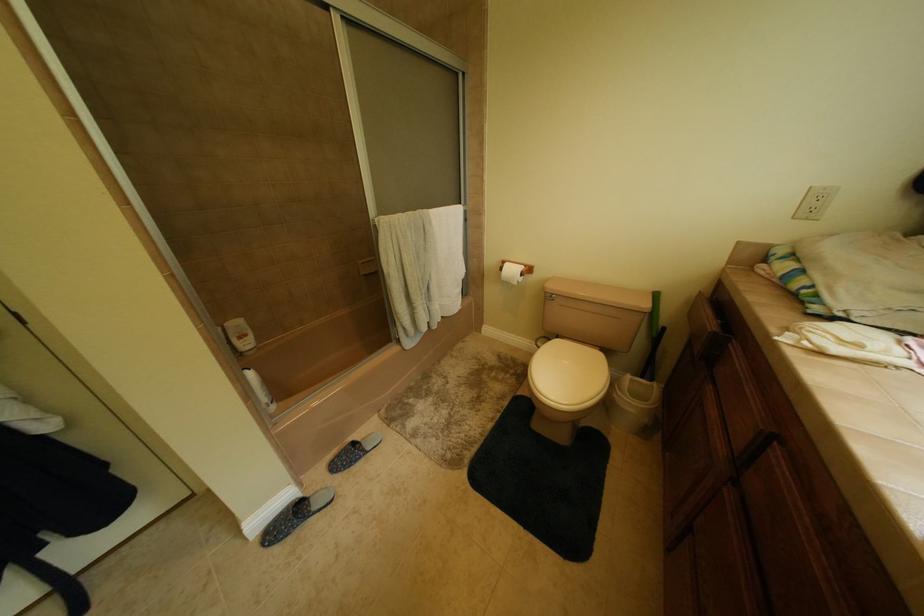
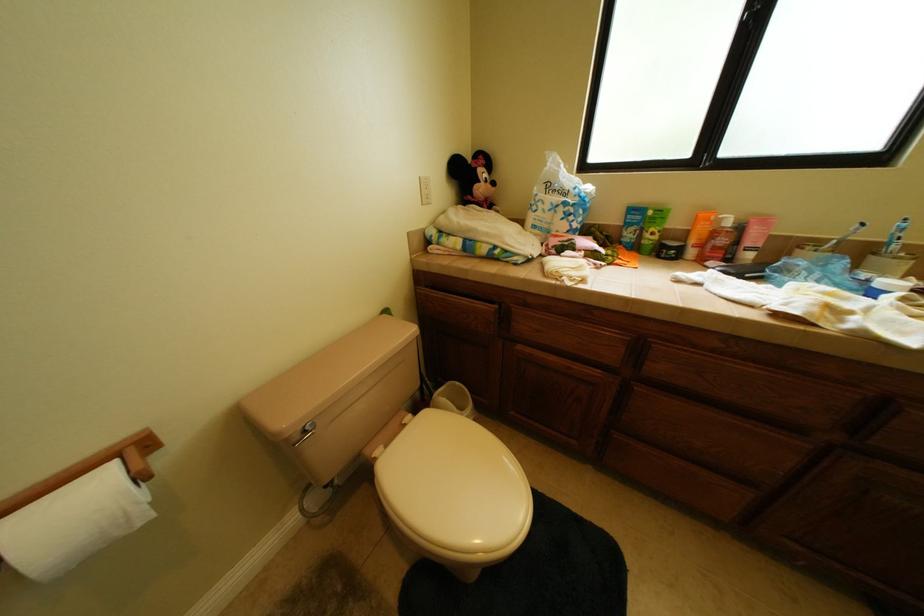
How did the camera likely rotate?

The rotation direction of the camera is right-down.